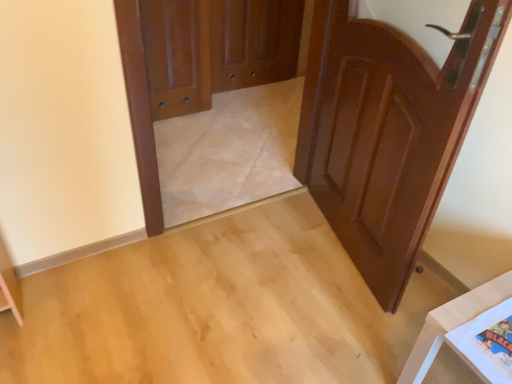
Question: From a real-world perspective, is brown wooden screen door at center physically above white glossy table at lower right?

Choices:
 (A) no
 (B) yes

Answer: (B)

Question: Is brown wooden screen door at center thinner than white glossy table at lower right?

Choices:
 (A) no
 (B) yes

Answer: (B)

Question: Is brown wooden screen door at center oriented away from white glossy table at lower right?

Choices:
 (A) no
 (B) yes

Answer: (A)

Question: Does brown wooden screen door at center have a greater width compared to white glossy table at lower right?

Choices:
 (A) yes
 (B) no

Answer: (B)

Question: Are brown wooden screen door at center and white glossy table at lower right far apart?

Choices:
 (A) yes
 (B) no

Answer: (A)

Question: Is shiny brown door at right, the 2th door in the back-to-front sequence, inside or outside of white glossy table at lower right?

Choices:
 (A) inside
 (B) outside

Answer: (B)

Question: Looking at their shapes, would you say shiny brown door at right, the 2th door in the back-to-front sequence, is wider or thinner than white glossy table at lower right?

Choices:
 (A) thin
 (B) wide

Answer: (A)

Question: Considering the positions of shiny brown door at right, the 2th door in the back-to-front sequence, and white glossy table at lower right in the image, is shiny brown door at right, the 2th door in the back-to-front sequence, bigger or smaller than white glossy table at lower right?

Choices:
 (A) big
 (B) small

Answer: (A)

Question: From the image's perspective, is shiny brown door at right, the first door positioned from the front, located above or below white glossy table at lower right?

Choices:
 (A) above
 (B) below

Answer: (A)

Question: Is white glossy table at lower right to the left or to the right of polished wood door at upper left, placed as the second door when sorted from front to back, in the image?

Choices:
 (A) right
 (B) left

Answer: (A)

Question: Does point (472, 312) appear closer or farther from the camera than point (181, 29)?

Choices:
 (A) closer
 (B) farther

Answer: (A)

Question: Is white glossy table at lower right inside or outside of polished wood door at upper left, placed as the second door when sorted from front to back?

Choices:
 (A) inside
 (B) outside

Answer: (B)

Question: From the image's perspective, is white glossy table at lower right positioned above or below polished wood door at upper left, placed as the second door when sorted from front to back?

Choices:
 (A) below
 (B) above

Answer: (A)

Question: Is brown wooden screen door at center spatially inside shiny brown door at right, the first door positioned from the front, or outside of it?

Choices:
 (A) outside
 (B) inside

Answer: (A)

Question: Does point (217, 31) appear closer or farther from the camera than point (413, 152)?

Choices:
 (A) farther
 (B) closer

Answer: (A)